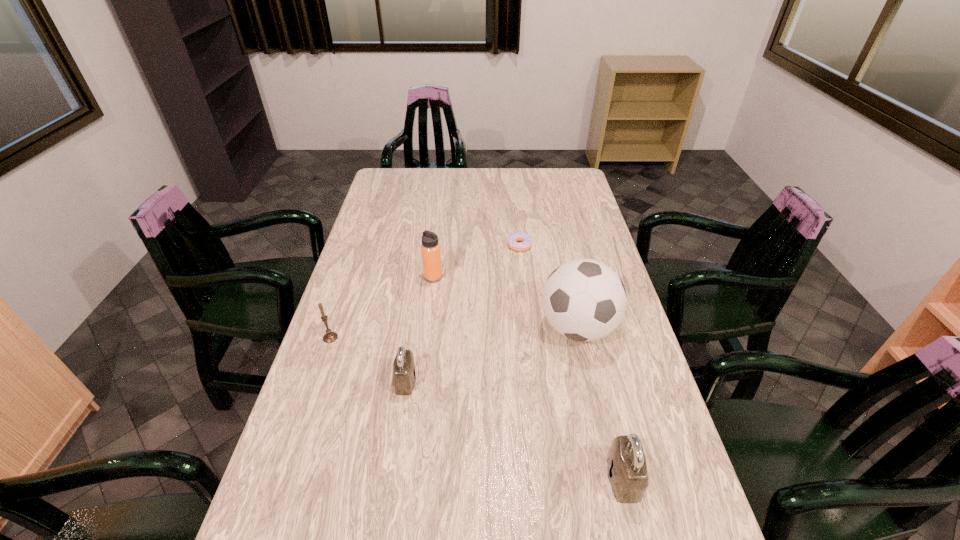
Find the location of a particular element. Image resolution: width=960 pixels, height=540 pixels. free spot located at the front of the fifth farthest object near the keyhole is located at coordinates (466, 381).

Where is `free point located at the front of the nearest object near the keyhole`? free point located at the front of the nearest object near the keyhole is located at coordinates (522, 478).

You are a GUI agent. You are given a task and a screenshot of the screen. Output one action in this format:
    pyautogui.click(x=<x>, y=<y>)
    Task: Click on the vacant area situated 0.110m at the front of the nearest object near the keyhole
    
    Given the screenshot: What is the action you would take?
    pyautogui.click(x=559, y=478)

This screenshot has width=960, height=540. In order to click on free space located 0.330m at the front of the nearest object near the keyhole in this screenshot , I will do `click(459, 478)`.

Locate an element on the screen. Image resolution: width=960 pixels, height=540 pixels. free region located 0.270m on the back of the soccer ball is located at coordinates (560, 249).

The width and height of the screenshot is (960, 540). In order to click on blank space located 0.280m on the right of the second tallest object in this screenshot , I will do pyautogui.click(x=525, y=278).

This screenshot has height=540, width=960. What are the coordinates of `free space located 0.340m on the front of the doughnut` in the screenshot? It's located at (528, 322).

Locate an element on the screen. Image resolution: width=960 pixels, height=540 pixels. vacant space located 0.050m on the back of the candle is located at coordinates [337, 320].

The width and height of the screenshot is (960, 540). In order to click on object present at the left edge in this screenshot , I will do `click(329, 337)`.

The width and height of the screenshot is (960, 540). I want to click on padlock that is at the right edge, so click(x=626, y=462).